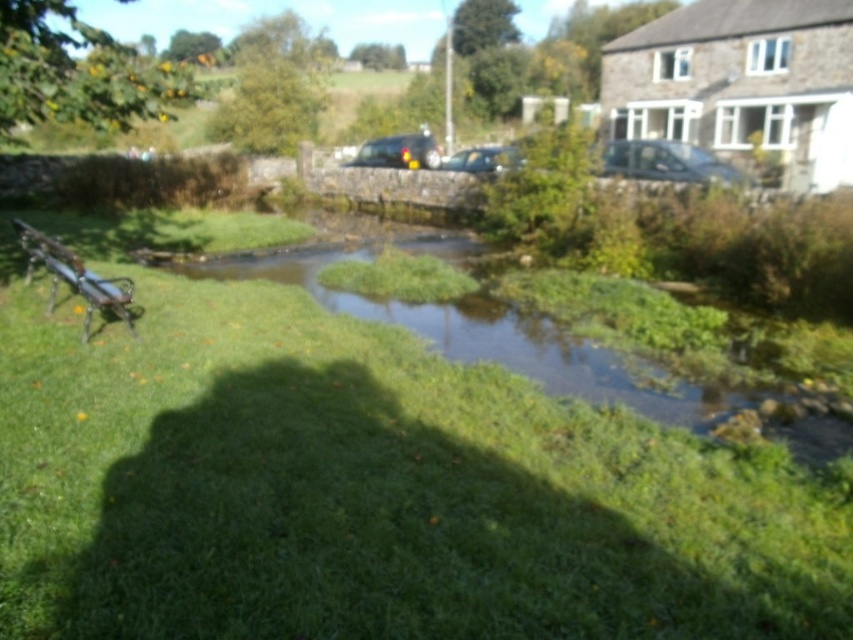
Is point (28, 291) positioned in front of point (74, 282)?

That is False.

You are a GUI agent. You are given a task and a screenshot of the screen. Output one action in this format:
    pyautogui.click(x=<x>, y=<y>)
    Task: Click on the green grass at center
    
    Given the screenshot: What is the action you would take?
    pyautogui.click(x=369, y=490)